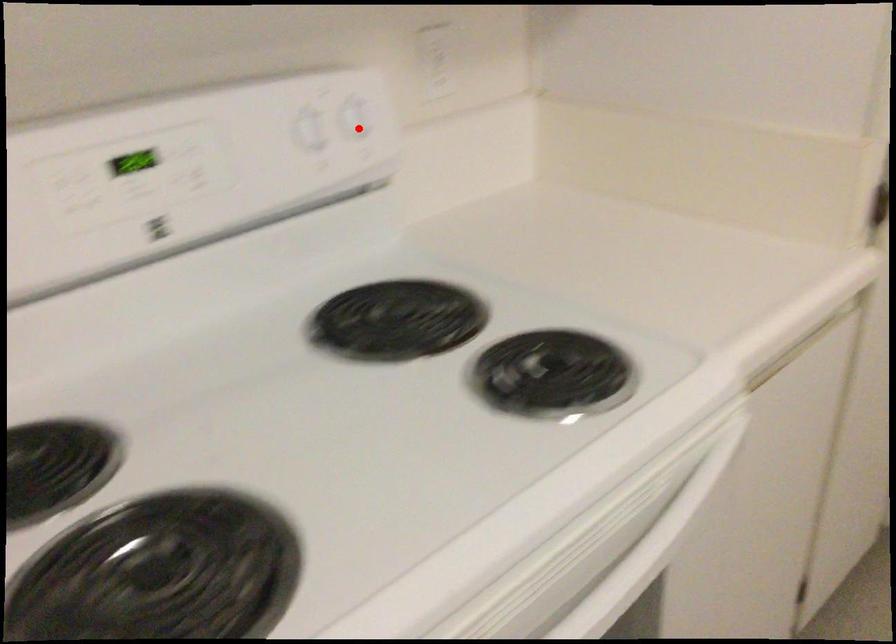
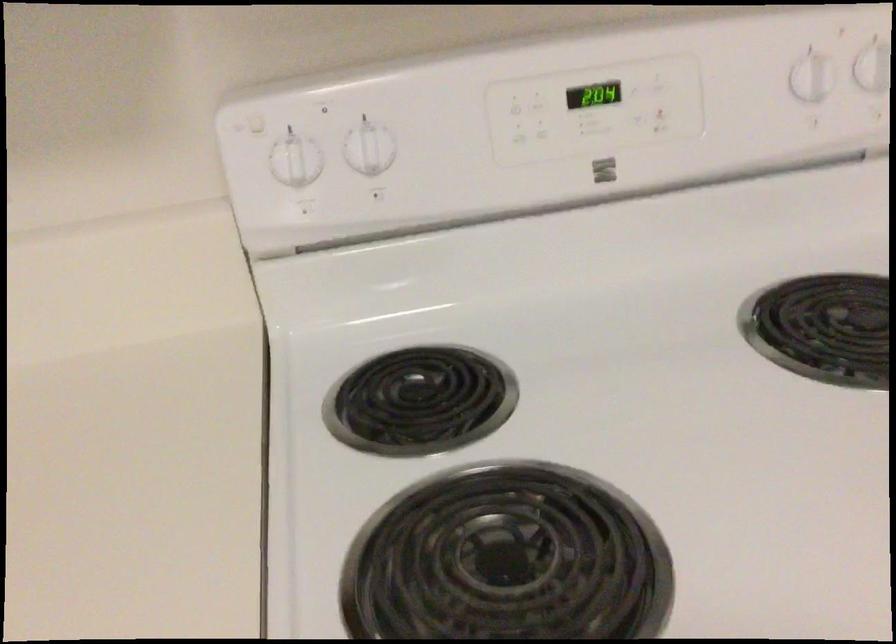
Question: I am providing you with two images of the same scene from different viewpoints. In image1, a red point is highlighted. Considering the same 3D point in image2, which of the following is correct?

Choices:
 (A) It is closer
 (B) It is farther

Answer: (A)